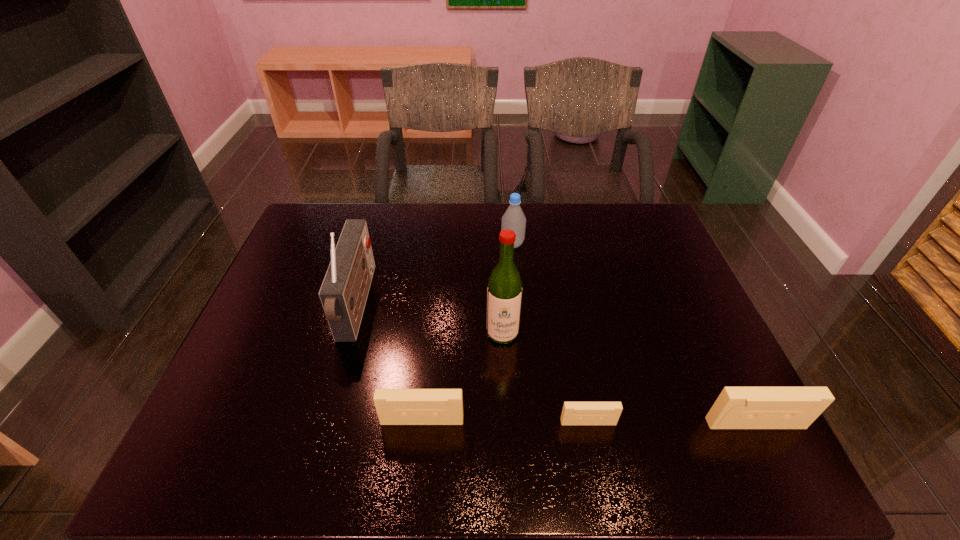
Considering the uniform spacing of videotapes, where should an additional videotape be positioned on the left? Please locate a free spot. Please provide its 2D coordinates. Your answer should be formatted as a tuple, i.e. [(x, y)], where the tuple contains the x and y coordinates of a point satisfying the conditions above.

[(257, 419)]